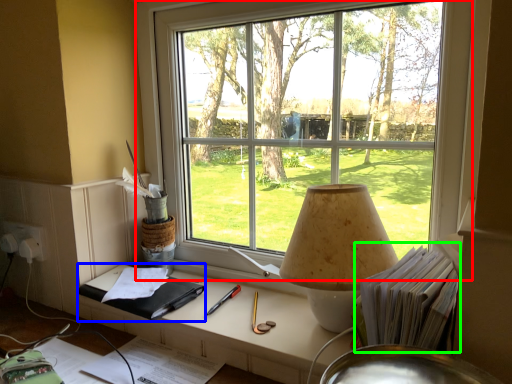
Question: Which object is positioned farthest from window (highlighted by a red box)? Select from notebook (highlighted by a blue box) and book (highlighted by a green box).

Choices:
 (A) notebook
 (B) book

Answer: (A)